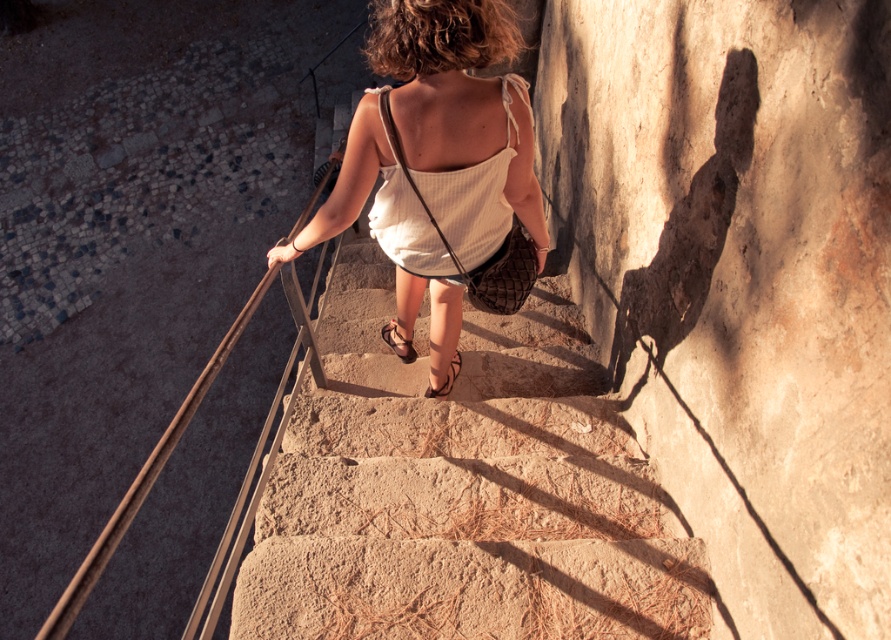
You are a delivery robot with a package that is 1.2 meters wide. You need to navigate through the stone textured stairs at center while avoiding the matte brown sandal at center. Can your package fit through the stairs without touching the sandal?

The stone textured stairs at center are wider than the matte brown sandal at center. Since the package is 1.2 meters wide and the stairs have enough width beyond the sandal, the package can fit through the stairs by positioning it away from the sandal.

You are a delivery robot with a package that needs to be placed between the stone textured stairs at center and the white ribbed fabric dress at center. The minimum required distance for placing the package is 90 centimeters. Can you safely place the package there?

The distance between the stone textured stairs at center and the white ribbed fabric dress at center is 91.17 centimeters, which is more than the required 90 centimeters. Therefore, the package can be safely placed there.